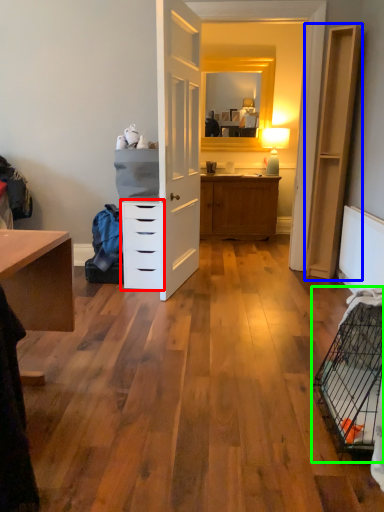
Question: Which object is positioned farthest from chest of drawers (highlighted by a red box)? Select from file cabinet (highlighted by a blue box) and bird cage (highlighted by a green box).

Choices:
 (A) file cabinet
 (B) bird cage

Answer: (B)